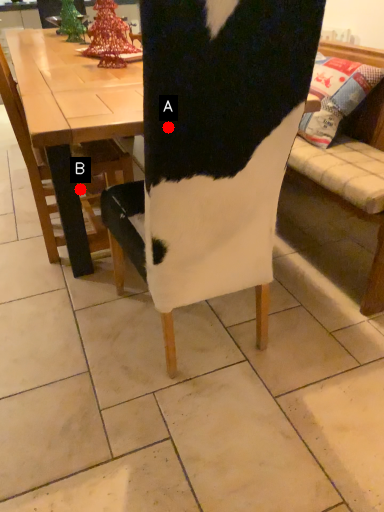
Question: Two points are circled on the image, labeled by A and B beside each circle. Which point appears closest to the camera in this image?

Choices:
 (A) A is closer
 (B) B is closer

Answer: (A)